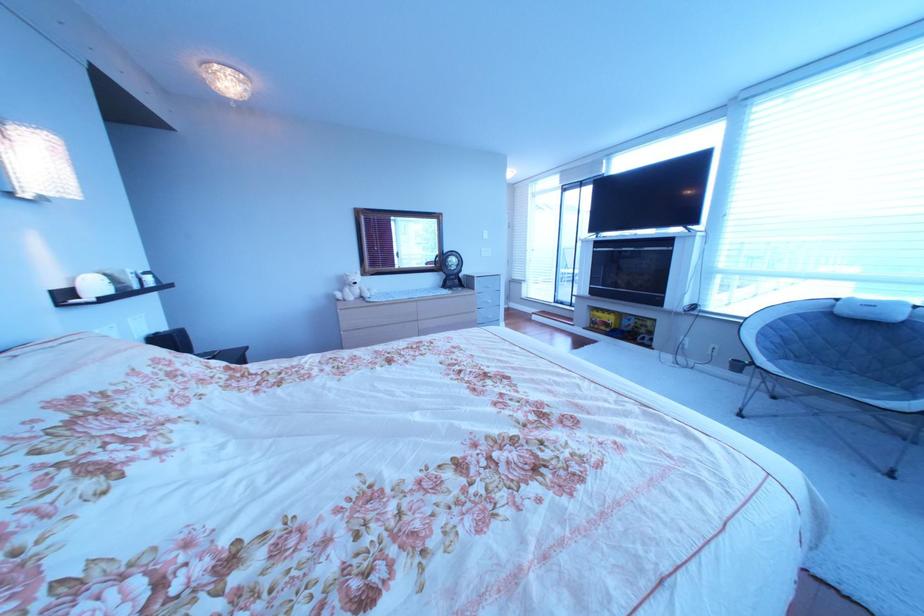
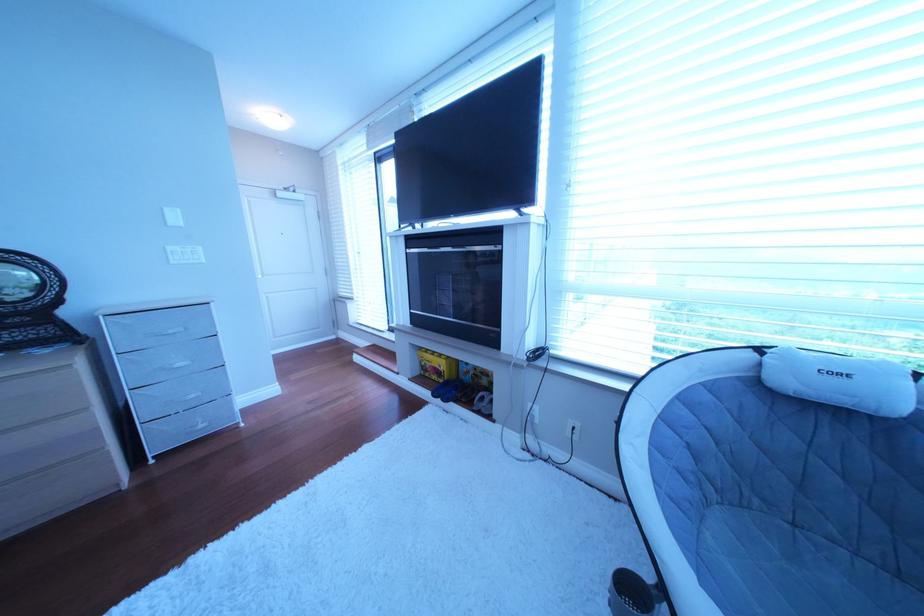
Where in the second image is the point corresponding to pixel 614 322 from the first image?

(444, 367)